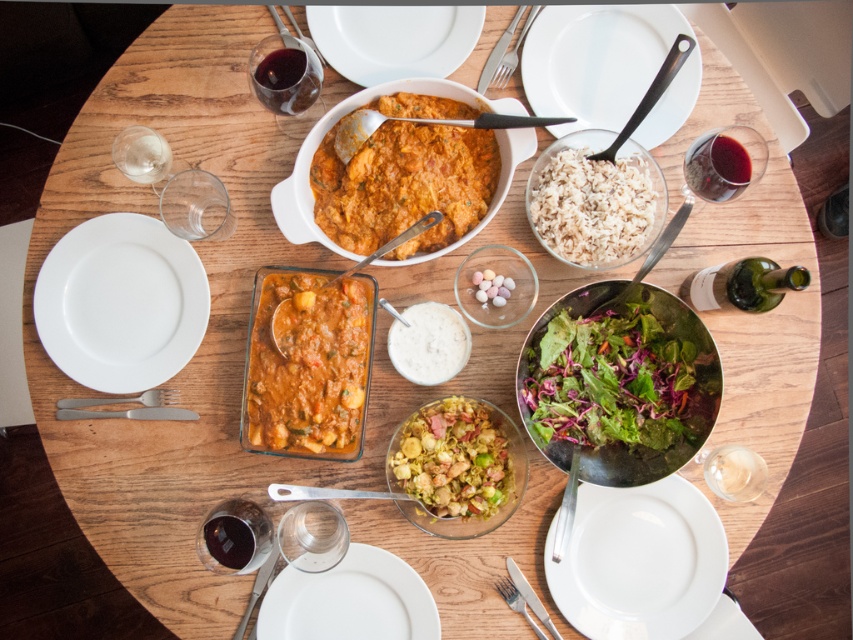
You are a guest sitting at the dining table and want to reach for the white glossy plate at lower right. Based on the coordinates provided, where exactly is the white glossy plate located relative to the center of the table?

The white glossy plate at lower right is located at coordinates point 0.877 on the x axis and 0.750 on the y axis relative to the center of the table.

You are a guest at this table and need to reach for the green glass bottle at lower right. From your seated position at the table, where should you look to find it?

The green glass bottle at lower right is located at the coordinates point [746,284] on the table.

You are a guest at this dinner and want to pour water into your glass. The green glass bottle at lower right and the silver metallic fork at upper center are on the table. Which object should you use to pour water?

The green glass bottle at lower right should be used to pour water since it is bigger than the silver metallic fork at upper center, indicating it likely contains liquid.